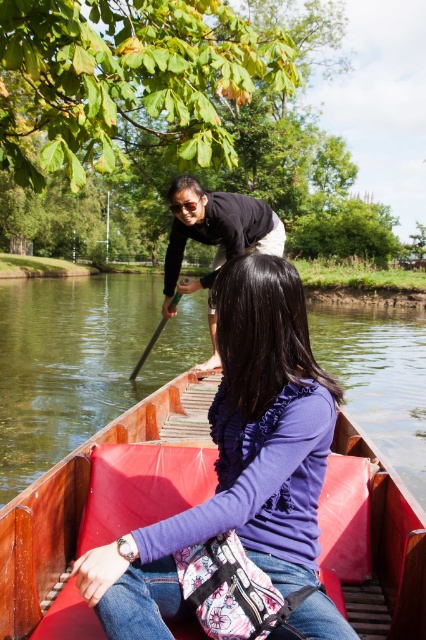
Is wooden boat at center in front of wooden canoe at center?

That is False.

Is point (46, 340) farther from viewer compared to point (396, 525)?

Yes, it is behind point (396, 525).

You are a GUI agent. You are given a task and a screenshot of the screen. Output one action in this format:
    pyautogui.click(x=<x>, y=<y>)
    Task: Click on the wooden boat at center
    
    Given the screenshot: What is the action you would take?
    pyautogui.click(x=80, y=362)

Is black matte shirt at upper center above green wood paddle at center?

Yes.

Between black matte shirt at upper center and green wood paddle at center, which one has more height?

Standing taller between the two is green wood paddle at center.

Does point (201, 218) come behind point (175, 292)?

No, it is in front of (175, 292).

The width and height of the screenshot is (426, 640). I want to click on black matte shirt at upper center, so click(x=215, y=230).

Does wooden canoe at center have a larger size compared to black matte shirt at upper center?

Correct, wooden canoe at center is larger in size than black matte shirt at upper center.

Between wooden canoe at center and black matte shirt at upper center, which one has more height?

black matte shirt at upper center

Is point (62, 563) closer to viewer compared to point (213, 330)?

Yes, point (62, 563) is closer to viewer.

Locate an element on the screen. This screenshot has height=640, width=426. wooden canoe at center is located at coordinates (85, 497).